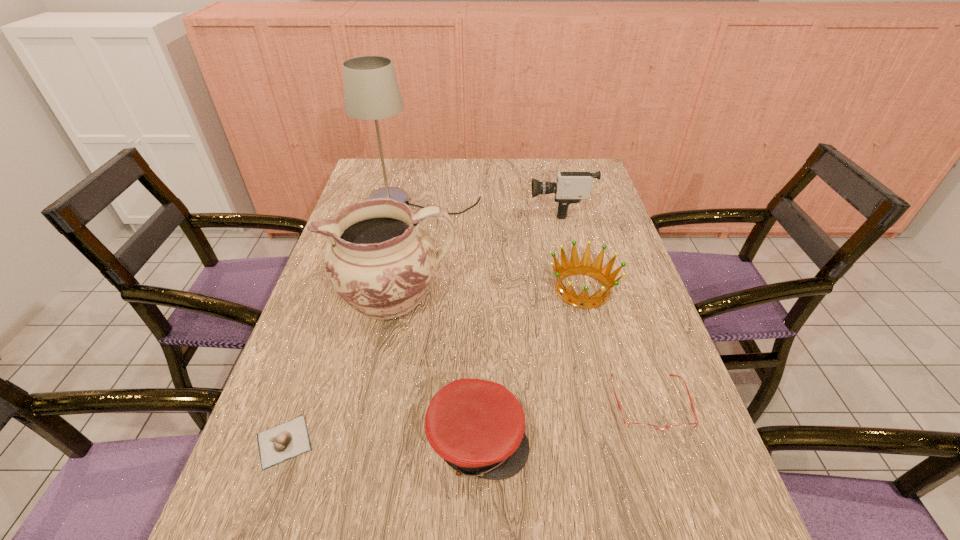
Where is `vacant space located on the recording direction of the fifth shortest object`? This screenshot has width=960, height=540. vacant space located on the recording direction of the fifth shortest object is located at coordinates (417, 209).

The image size is (960, 540). In order to click on free space located on the recording direction of the fifth shortest object in this screenshot , I will do `click(417, 209)`.

Image resolution: width=960 pixels, height=540 pixels. I want to click on vacant area situated 0.310m on the back of the crown, so (562, 206).

Image resolution: width=960 pixels, height=540 pixels. I want to click on vacant region located 0.320m on the front of the cap with an emblem, so click(692, 440).

The height and width of the screenshot is (540, 960). I want to click on vacant space situated on the lenses of the spectacles, so click(x=670, y=466).

This screenshot has width=960, height=540. In order to click on free space located on the right of the shortest object in this screenshot , I will do pos(392,442).

You are a GUI agent. You are given a task and a screenshot of the screen. Output one action in this format:
    pyautogui.click(x=<x>, y=<y>)
    Task: Click on the object that is at the far edge
    The width and height of the screenshot is (960, 540).
    Given the screenshot: What is the action you would take?
    pos(371,92)

Where is `table lamp at the left edge`? This screenshot has width=960, height=540. table lamp at the left edge is located at coordinates (371, 92).

Locate an element on the screen. pitcher present at the left edge is located at coordinates (379, 258).

Find the location of a particular element. The width and height of the screenshot is (960, 540). garlic that is at the left edge is located at coordinates (278, 444).